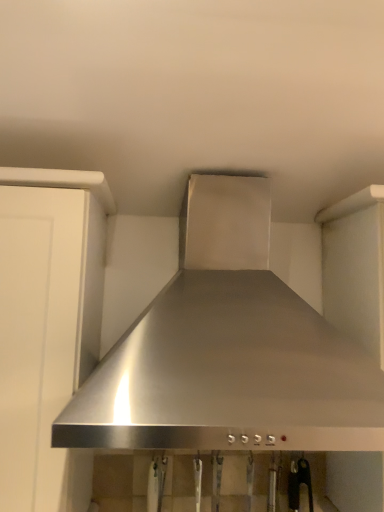
Question: From the image's perspective, is white matte cabinet at left positioned above or below stainless steel range hood at center?

Choices:
 (A) below
 (B) above

Answer: (A)

Question: Based on their positions, is white matte cabinet at left located to the left or right of stainless steel range hood at center?

Choices:
 (A) left
 (B) right

Answer: (A)

Question: Is point (51, 351) positioned closer to the camera than point (294, 324)?

Choices:
 (A) closer
 (B) farther

Answer: (A)

Question: Is stainless steel range hood at center taller or shorter than white matte cabinet at left?

Choices:
 (A) tall
 (B) short

Answer: (B)

Question: Based on their positions, is stainless steel range hood at center located to the left or right of white matte cabinet at left?

Choices:
 (A) right
 (B) left

Answer: (A)

Question: From the image's perspective, is stainless steel range hood at center located above or below white matte cabinet at left?

Choices:
 (A) above
 (B) below

Answer: (A)

Question: Choose the correct answer: Is stainless steel range hood at center inside white matte cabinet at left or outside it?

Choices:
 (A) outside
 (B) inside

Answer: (A)